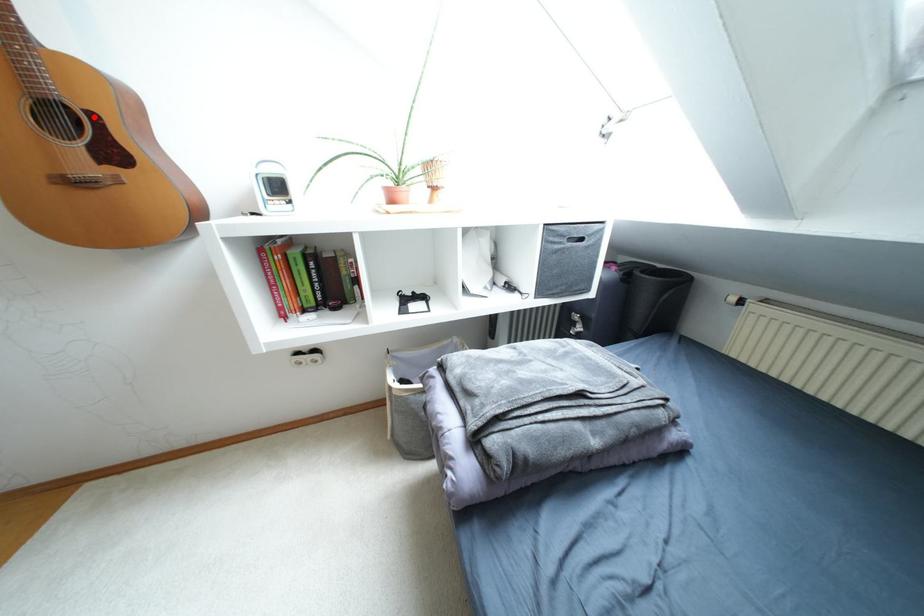
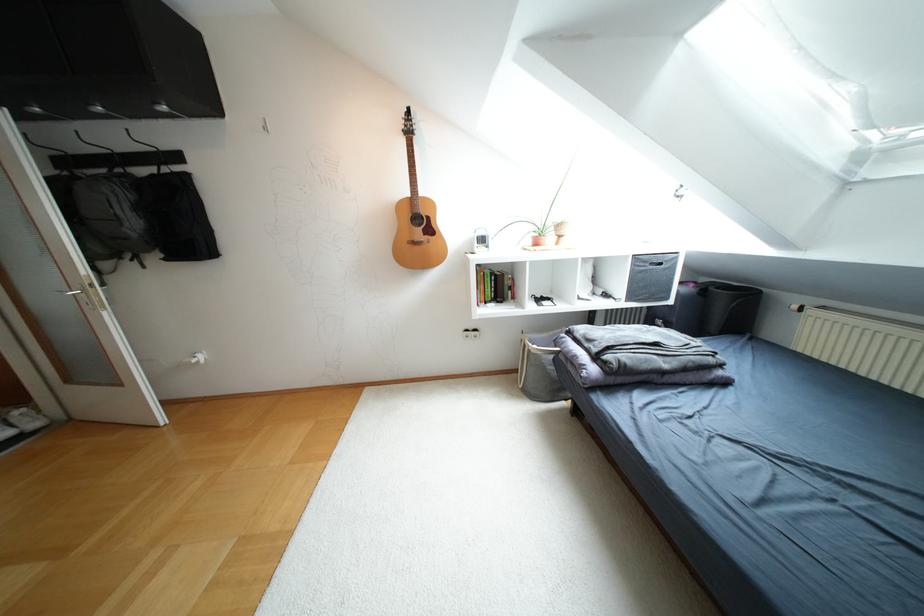
Find the pixel in the second image that matches the highlighted location in the first image.

(428, 217)